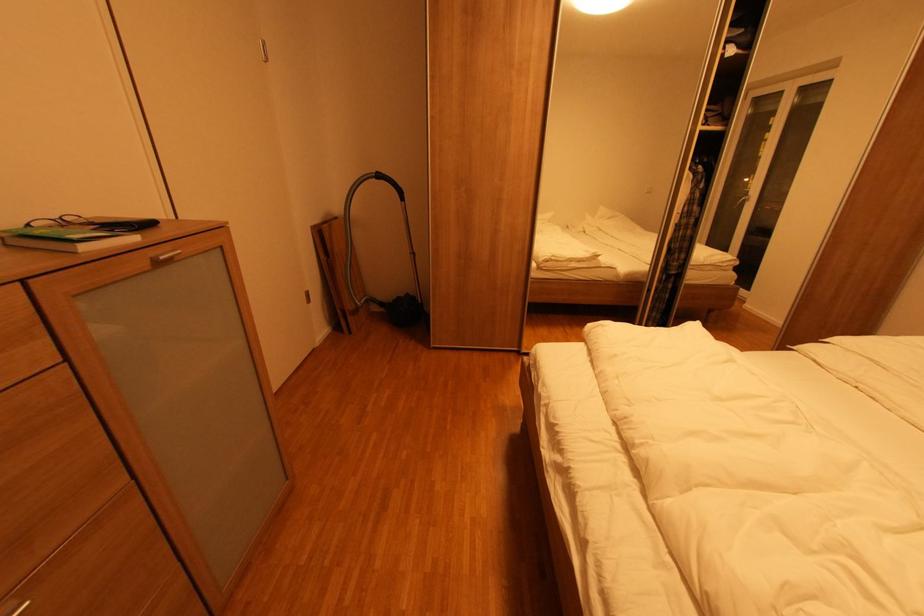
Where would you pull the silver cabinet handle? Please return your answer as a coordinate pair (x, y).

(165, 257)